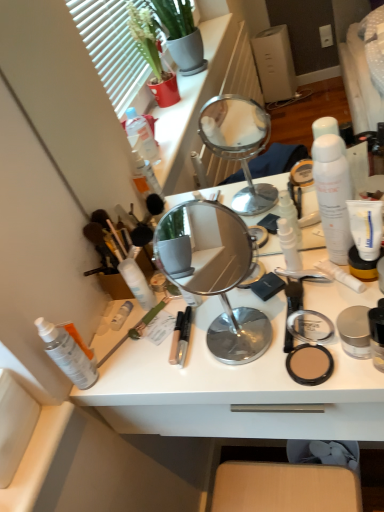
Where is `free area in between polished silver mirror at center and white matte spray can at center, which is the third toiletry in right-to-left order`? The height and width of the screenshot is (512, 384). free area in between polished silver mirror at center and white matte spray can at center, which is the third toiletry in right-to-left order is located at coordinates (191, 320).